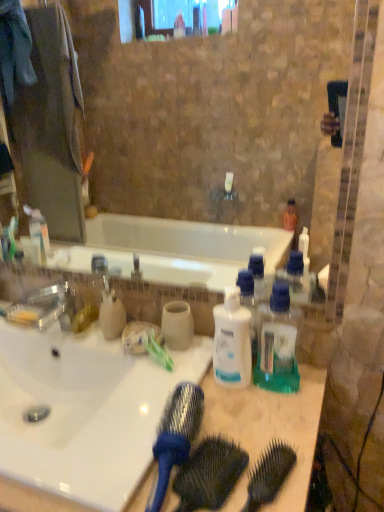
The width and height of the screenshot is (384, 512). I want to click on free space to the left of green plastic toothbrush at center, so click(110, 360).